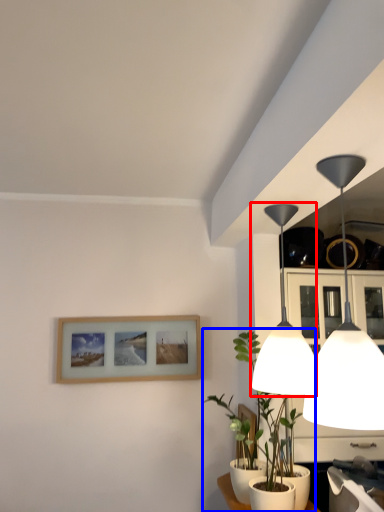
Question: Which point is closer to the camera, lamp (highlighted by a red box) or houseplant (highlighted by a blue box)?

Choices:
 (A) lamp
 (B) houseplant

Answer: (A)